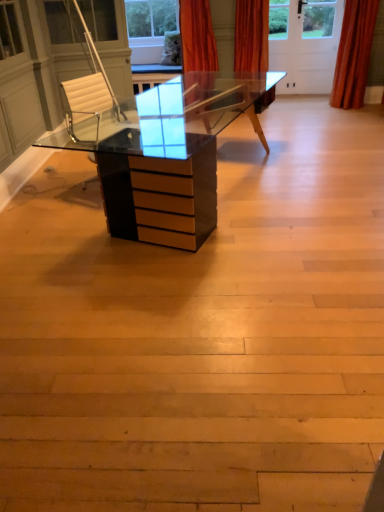
Image resolution: width=384 pixels, height=512 pixels. What do you see at coordinates (197, 36) in the screenshot?
I see `orange velvet curtain at upper center, which is the first curtain from left to right` at bounding box center [197, 36].

Locate an element on the screen. The width and height of the screenshot is (384, 512). orange velvet curtain at upper center, which ranks as the second curtain in right-to-left order is located at coordinates (197, 36).

The height and width of the screenshot is (512, 384). Find the location of `orange velvet curtain at upper right, placed as the first curtain when sorted from right to left`. orange velvet curtain at upper right, placed as the first curtain when sorted from right to left is located at coordinates (354, 54).

Image resolution: width=384 pixels, height=512 pixels. Describe the element at coordinates (354, 54) in the screenshot. I see `orange velvet curtain at upper right, placed as the first curtain when sorted from right to left` at that location.

Locate an element on the screen. orange velvet curtain at upper center, which ranks as the second curtain in right-to-left order is located at coordinates (197, 36).

Is orange velvet curtain at upper right, which appears as the 2th curtain when viewed from the left, to the left or to the right of orange velvet curtain at upper center, which ranks as the second curtain in right-to-left order, in the image?

orange velvet curtain at upper right, which appears as the 2th curtain when viewed from the left, is positioned on orange velvet curtain at upper center, which ranks as the second curtain in right-to-left order,'s right side.

From the picture: Considering their positions, is orange velvet curtain at upper right, which appears as the 2th curtain when viewed from the left, located in front of or behind orange velvet curtain at upper center, which is the first curtain from left to right?

In the image, orange velvet curtain at upper right, which appears as the 2th curtain when viewed from the left, appears behind orange velvet curtain at upper center, which is the first curtain from left to right.

Does point (358, 44) come behind point (186, 14)?

Yes.

From the image's perspective, is orange velvet curtain at upper right, which appears as the 2th curtain when viewed from the left, positioned above or below orange velvet curtain at upper center, which is the first curtain from left to right?

orange velvet curtain at upper right, which appears as the 2th curtain when viewed from the left, is below orange velvet curtain at upper center, which is the first curtain from left to right.

From a real-world perspective, does orange velvet curtain at upper right, which appears as the 2th curtain when viewed from the left, stand above orange velvet curtain at upper center, which ranks as the second curtain in right-to-left order?

No, from a real-world perspective, orange velvet curtain at upper right, which appears as the 2th curtain when viewed from the left, is not over orange velvet curtain at upper center, which ranks as the second curtain in right-to-left order

Which of these two, orange velvet curtain at upper right, which appears as the 2th curtain when viewed from the left, or orange velvet curtain at upper center, which ranks as the second curtain in right-to-left order, is thinner?

orange velvet curtain at upper right, which appears as the 2th curtain when viewed from the left.

Considering the sizes of orange velvet curtain at upper right, placed as the first curtain when sorted from right to left, and orange velvet curtain at upper center, which ranks as the second curtain in right-to-left order, in the image, is orange velvet curtain at upper right, placed as the first curtain when sorted from right to left, taller or shorter than orange velvet curtain at upper center, which ranks as the second curtain in right-to-left order,?

Considering their sizes, orange velvet curtain at upper right, placed as the first curtain when sorted from right to left, has more height than orange velvet curtain at upper center, which ranks as the second curtain in right-to-left order.

Does orange velvet curtain at upper right, which appears as the 2th curtain when viewed from the left, have a smaller size compared to orange velvet curtain at upper center, which ranks as the second curtain in right-to-left order?

Indeed, orange velvet curtain at upper right, which appears as the 2th curtain when viewed from the left, has a smaller size compared to orange velvet curtain at upper center, which ranks as the second curtain in right-to-left order.

Is orange velvet curtain at upper center, which is the first curtain from left to right, located within orange velvet curtain at upper right, placed as the first curtain when sorted from right to left?

No.

Would you consider orange velvet curtain at upper right, placed as the first curtain when sorted from right to left, to be distant from orange velvet curtain at upper center, which ranks as the second curtain in right-to-left order?

Yes, orange velvet curtain at upper right, placed as the first curtain when sorted from right to left, is far from orange velvet curtain at upper center, which ranks as the second curtain in right-to-left order.

Could you tell me if orange velvet curtain at upper right, which appears as the 2th curtain when viewed from the left, is turned towards orange velvet curtain at upper center, which ranks as the second curtain in right-to-left order?

No, orange velvet curtain at upper right, which appears as the 2th curtain when viewed from the left, is not turned towards orange velvet curtain at upper center, which ranks as the second curtain in right-to-left order.

Image resolution: width=384 pixels, height=512 pixels. I want to click on curtain below the orange velvet curtain at upper center, which is the first curtain from left to right (from the image's perspective), so click(x=354, y=54).

Between orange velvet curtain at upper center, which ranks as the second curtain in right-to-left order, and orange velvet curtain at upper right, which appears as the 2th curtain when viewed from the left, which one appears on the right side from the viewer's perspective?

orange velvet curtain at upper right, which appears as the 2th curtain when viewed from the left.

Is the position of orange velvet curtain at upper center, which is the first curtain from left to right, more distant than that of orange velvet curtain at upper right, which appears as the 2th curtain when viewed from the left?

No, the depth of orange velvet curtain at upper center, which is the first curtain from left to right, is less than that of orange velvet curtain at upper right, which appears as the 2th curtain when viewed from the left.

Does point (202, 38) lie behind point (358, 27)?

That is False.

From the image's perspective, which is above, orange velvet curtain at upper center, which ranks as the second curtain in right-to-left order, or orange velvet curtain at upper right, which appears as the 2th curtain when viewed from the left?

orange velvet curtain at upper center, which ranks as the second curtain in right-to-left order, appears higher in the image.

From a real-world perspective, which object stands above the other?

In real-world perspective, orange velvet curtain at upper center, which ranks as the second curtain in right-to-left order, is above.

Considering the relative sizes of orange velvet curtain at upper center, which ranks as the second curtain in right-to-left order, and orange velvet curtain at upper right, which appears as the 2th curtain when viewed from the left, in the image provided, is orange velvet curtain at upper center, which ranks as the second curtain in right-to-left order, thinner than orange velvet curtain at upper right, which appears as the 2th curtain when viewed from the left,?

→ In fact, orange velvet curtain at upper center, which ranks as the second curtain in right-to-left order, might be wider than orange velvet curtain at upper right, which appears as the 2th curtain when viewed from the left.

In terms of height, does orange velvet curtain at upper center, which ranks as the second curtain in right-to-left order, look taller or shorter compared to orange velvet curtain at upper right, placed as the first curtain when sorted from right to left?

Clearly, orange velvet curtain at upper center, which ranks as the second curtain in right-to-left order, is shorter compared to orange velvet curtain at upper right, placed as the first curtain when sorted from right to left.

Which of these two, orange velvet curtain at upper center, which ranks as the second curtain in right-to-left order, or orange velvet curtain at upper right, placed as the first curtain when sorted from right to left, is smaller?

With smaller size is orange velvet curtain at upper right, placed as the first curtain when sorted from right to left.

Is orange velvet curtain at upper center, which is the first curtain from left to right, located outside orange velvet curtain at upper right, which appears as the 2th curtain when viewed from the left?

orange velvet curtain at upper center, which is the first curtain from left to right, lies outside orange velvet curtain at upper right, which appears as the 2th curtain when viewed from the left,'s area.

Would you say orange velvet curtain at upper center, which ranks as the second curtain in right-to-left order, is a long distance from orange velvet curtain at upper right, placed as the first curtain when sorted from right to left?

Yes, orange velvet curtain at upper center, which ranks as the second curtain in right-to-left order, and orange velvet curtain at upper right, placed as the first curtain when sorted from right to left, are quite far apart.

Is orange velvet curtain at upper center, which ranks as the second curtain in right-to-left order, oriented away from orange velvet curtain at upper right, which appears as the 2th curtain when viewed from the left?

That's not correct — orange velvet curtain at upper center, which ranks as the second curtain in right-to-left order, is not looking away from orange velvet curtain at upper right, which appears as the 2th curtain when viewed from the left.

What's the angular difference between orange velvet curtain at upper center, which ranks as the second curtain in right-to-left order, and orange velvet curtain at upper right, which appears as the 2th curtain when viewed from the left,'s facing directions?

0.419 degrees.

The image size is (384, 512). In order to click on curtain in front of the orange velvet curtain at upper right, which appears as the 2th curtain when viewed from the left in this screenshot , I will do `click(197, 36)`.

This screenshot has width=384, height=512. I want to click on curtain above the orange velvet curtain at upper right, placed as the first curtain when sorted from right to left (from the image's perspective), so click(x=197, y=36).

At what (x,y) coordinates should I click in order to perform the action: click on curtain located underneath the orange velvet curtain at upper center, which is the first curtain from left to right (from a real-world perspective). Please return your answer as a coordinate pair (x, y). The image size is (384, 512). Looking at the image, I should click on (354, 54).